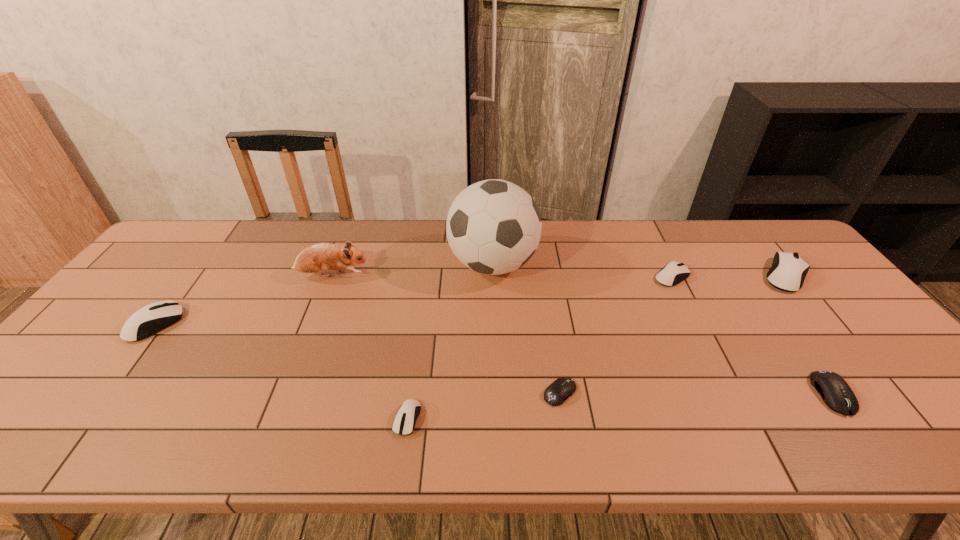
Identify the location of the right black computer equipment. The width and height of the screenshot is (960, 540). (836, 393).

At what (x,y) coordinates should I click in order to perform the action: click on the seventh object from left to right. Please return your answer as a coordinate pair (x, y). Looking at the image, I should click on (836, 393).

At what (x,y) coordinates should I click in order to perform the action: click on the sixth object from right to left. Please return your answer as a coordinate pair (x, y). This screenshot has width=960, height=540. Looking at the image, I should click on (404, 422).

Locate an element on the screen. The image size is (960, 540). the smallest white mouse is located at coordinates (404, 422).

Find the location of a particular element. the smaller black computer equipment is located at coordinates (561, 389).

Identify the location of the left black computer equipment. (561, 389).

The width and height of the screenshot is (960, 540). In order to click on free space located 0.310m on the right of the soccer ball in this screenshot , I will do `click(637, 265)`.

The image size is (960, 540). I want to click on free region located 0.260m at the face of the second object from left to right, so click(456, 275).

I want to click on vacant position located on the back of the biggest white mouse, so click(763, 247).

Locate an element on the screen. This screenshot has width=960, height=540. vacant space located on the back of the second nearest white mouse is located at coordinates (229, 226).